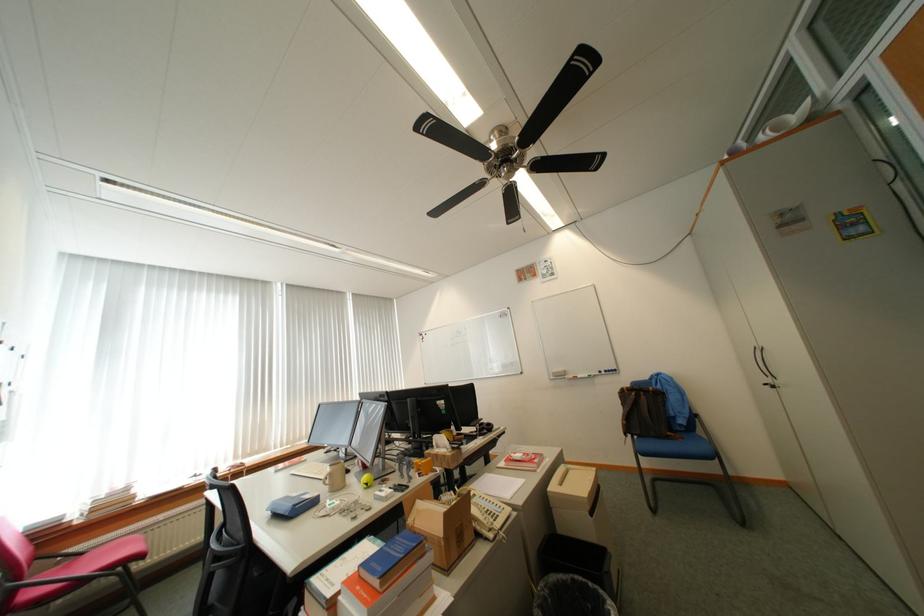
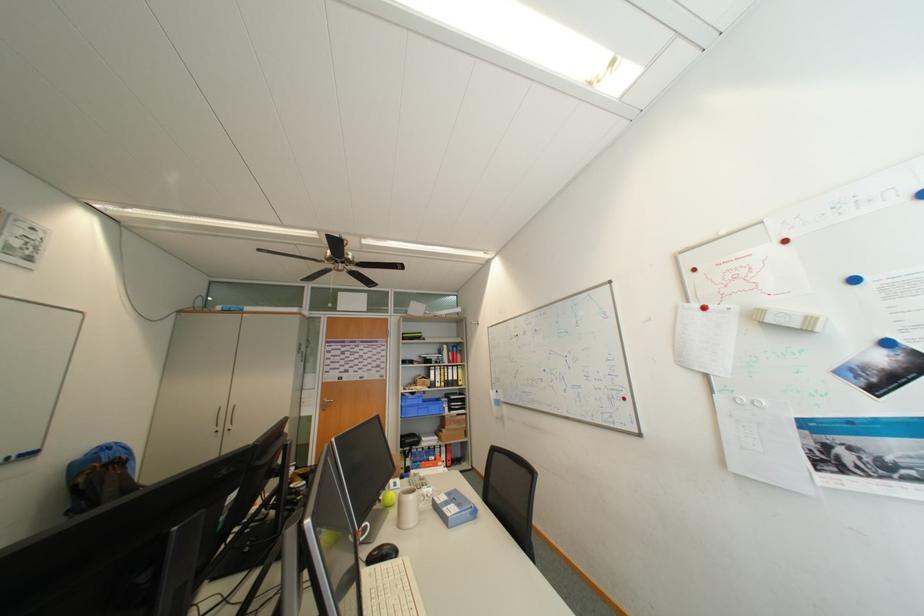
Locate, in the second image, the point that corresponds to point 779,382 in the first image.

(229, 429)